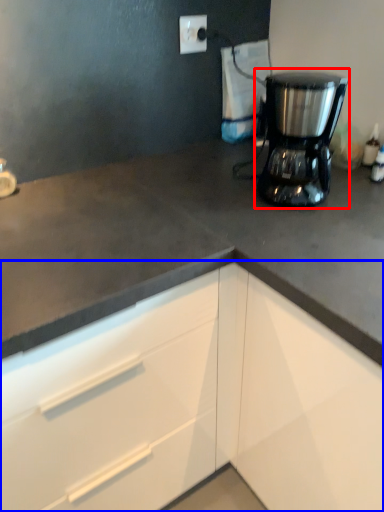
Question: Among these objects, which one is farthest to the camera, home appliance (highlighted by a red box) or cabinetry (highlighted by a blue box)?

Choices:
 (A) home appliance
 (B) cabinetry

Answer: (A)